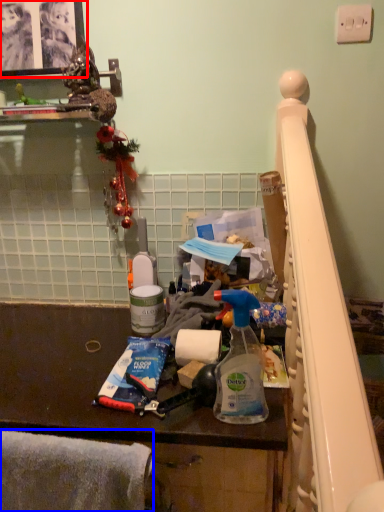
Question: Which object is further to the camera taking this photo, picture frame (highlighted by a red box) or blanket (highlighted by a blue box)?

Choices:
 (A) picture frame
 (B) blanket

Answer: (A)